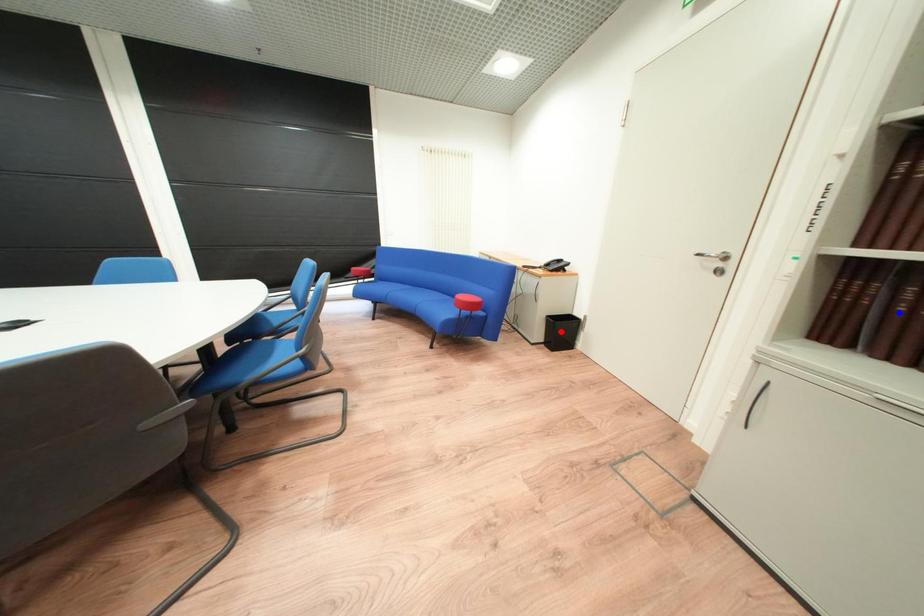
Question: In the image, two points are highlighted. Which point is nearer to the camera? Reply with the corresponding letter.

Choices:
 (A) blue point
 (B) red point

Answer: (A)